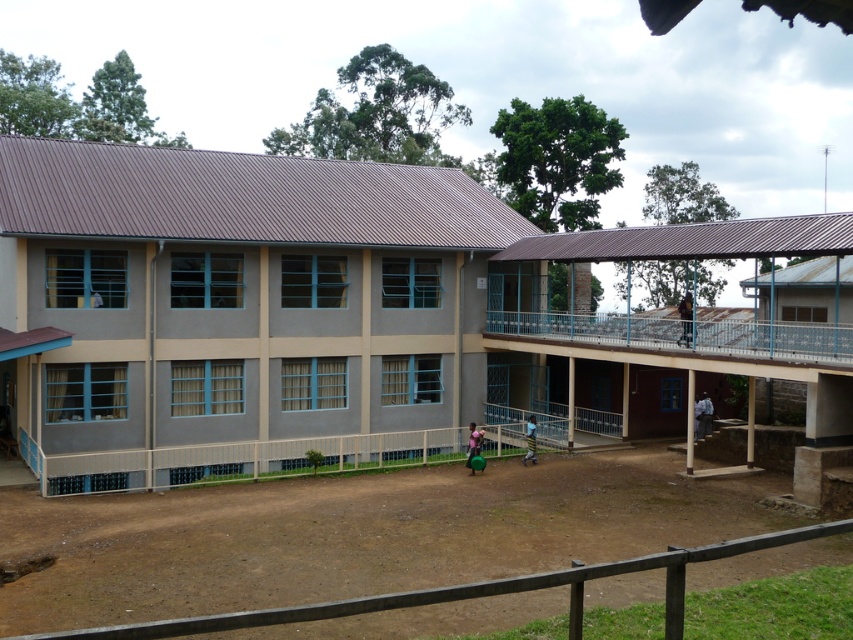
Question: Is pink fabric bag at center bigger than yellow striped skirt at center?

Choices:
 (A) no
 (B) yes

Answer: (B)

Question: Among these points, which one is nearest to the camera?

Choices:
 (A) (474, 451)
 (B) (531, 436)
 (C) (708, 412)
 (D) (689, 324)

Answer: (D)

Question: Is blue fabric shirt at lower right wider than dark blue uniform at upper center?

Choices:
 (A) yes
 (B) no

Answer: (B)

Question: Which object is the closest to the blue fabric shirt at lower right?

Choices:
 (A) dark blue uniform at upper center
 (B) yellow striped skirt at center
 (C) pink fabric bag at center

Answer: (A)

Question: Which point is closer to the camera?

Choices:
 (A) (531, 444)
 (B) (694, 406)
 (C) (683, 317)

Answer: (C)

Question: Is pink fabric bag at center below yellow striped skirt at center?

Choices:
 (A) no
 (B) yes

Answer: (A)